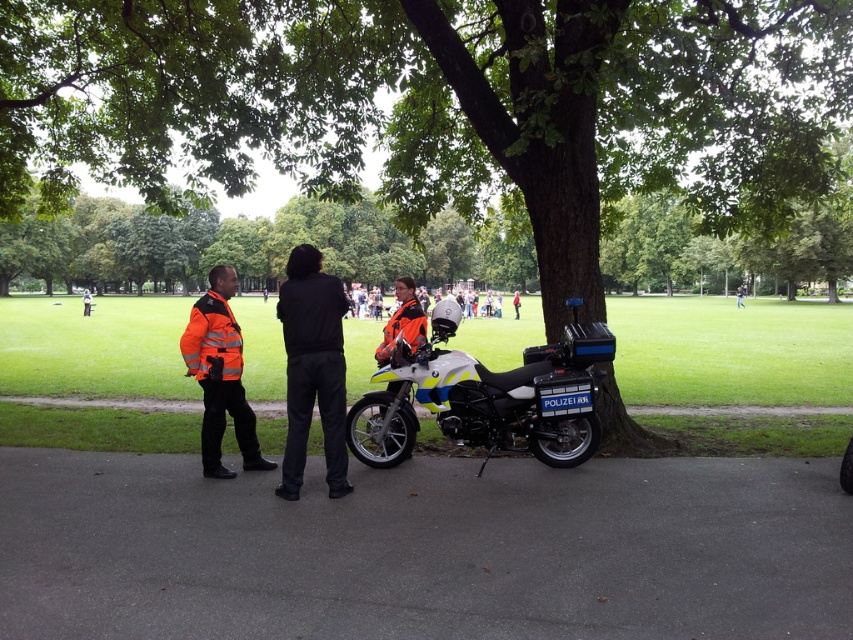
You are a pedestrian standing at the edge of the park pathway. You see a white matte motorcycle at center and an orange reflective jacket at center. Which object is closer to your right side?

The white matte motorcycle at center is positioned on the right side of orange reflective jacket at center, so it is closer to your right side.

You are a photographer standing near the camera. You want to take a photo of the black matte pants at center. Can you reach the pants without moving the camera? The minimum focusing distance of your camera is 5 meters.

The black matte pants at center and camera are 6.06 meters apart. Since the minimum focusing distance is 5 meters, the camera can focus on the black matte pants at center from that distance.

You are a pedestrian standing at point (401, 317) and want to walk to point (212, 470). Are you walking towards the police motorcycle or away from it?

Point (212, 470) is in front of point (401, 317), so walking towards point (212, 470) means you are moving towards the police motorcycle.